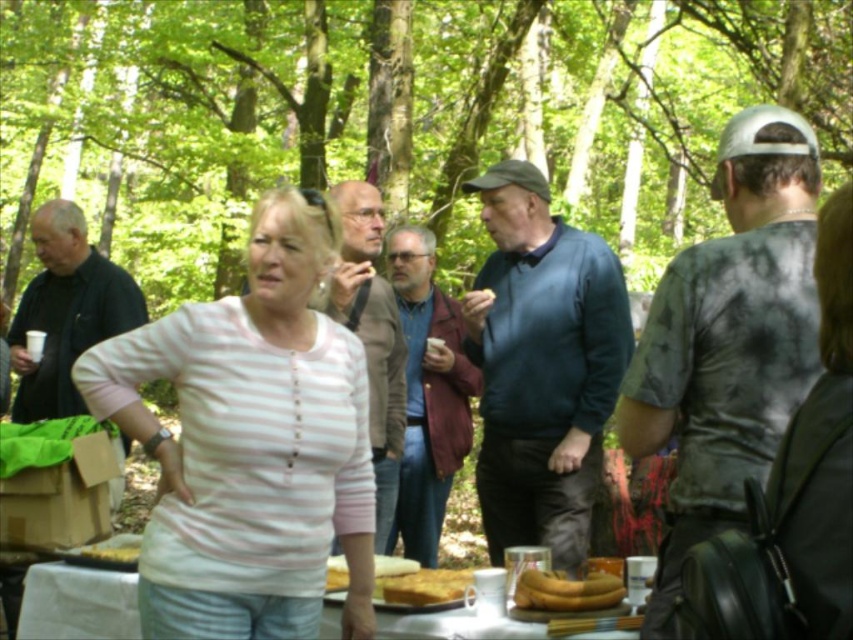
Question: Can you confirm if white glossy table at lower center is smaller than yellow matte bananas at center?

Choices:
 (A) no
 (B) yes

Answer: (A)

Question: Where is white glossy table at lower center located in relation to golden brown cake at center in the image?

Choices:
 (A) left
 (B) right

Answer: (A)

Question: Can you confirm if yellow matte bananas at center is positioned above smooth white bread at lower center?

Choices:
 (A) yes
 (B) no

Answer: (A)

Question: Which object is the farthest from the yellow matte bananas at center?

Choices:
 (A) white glossy table at lower center
 (B) golden brown cake at center

Answer: (A)

Question: Estimate the real-world distances between objects in this image. Which object is closer to the white glossy table at lower center?

Choices:
 (A) golden brown cake at center
 (B) yellow matte bananas at center
 (C) pink striped shirt at center
 (D) smooth white bread at lower center

Answer: (D)

Question: Among these points, which one is nearest to the camera?

Choices:
 (A) (457, 596)
 (B) (408, 627)

Answer: (B)